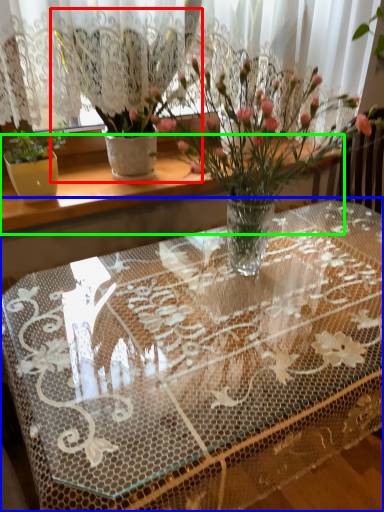
Question: Estimate the real-world distances between objects in this image. Which object is closer to houseplant (highlighted by a red box), table (highlighted by a blue box) or window sill (highlighted by a green box)?

Choices:
 (A) table
 (B) window sill

Answer: (B)